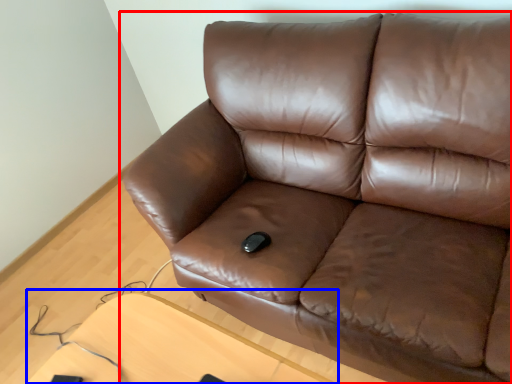
Question: Among these objects, which one is nearest to the camera, studio couch (highlighted by a red box) or table (highlighted by a blue box)?

Choices:
 (A) studio couch
 (B) table

Answer: (A)